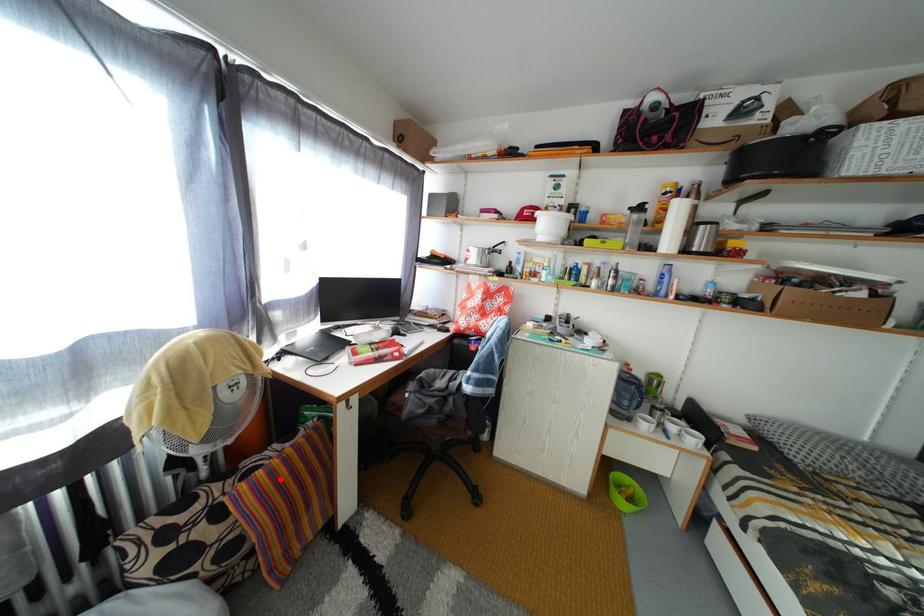
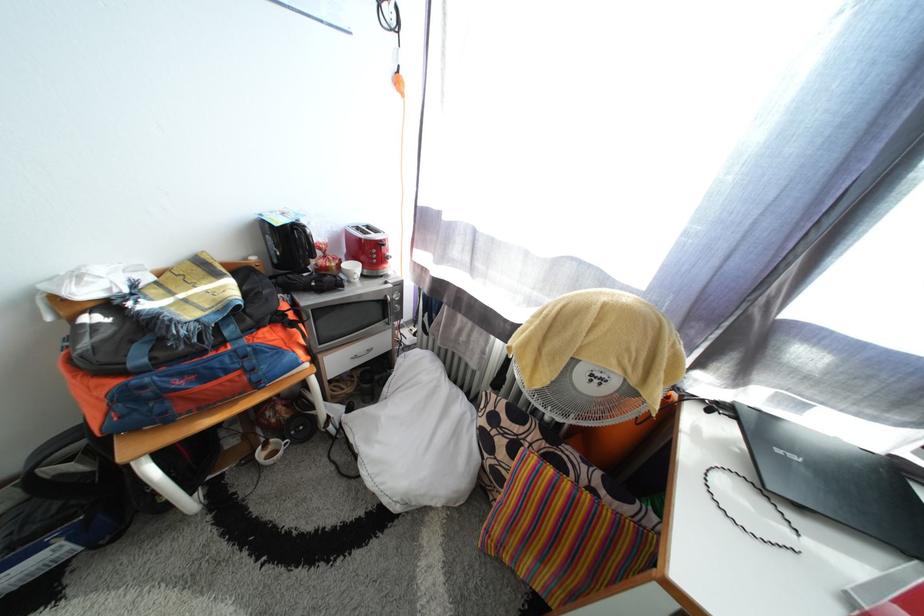
Where in the second image is the point corresponding to the highlighted location from the first image?

(563, 493)